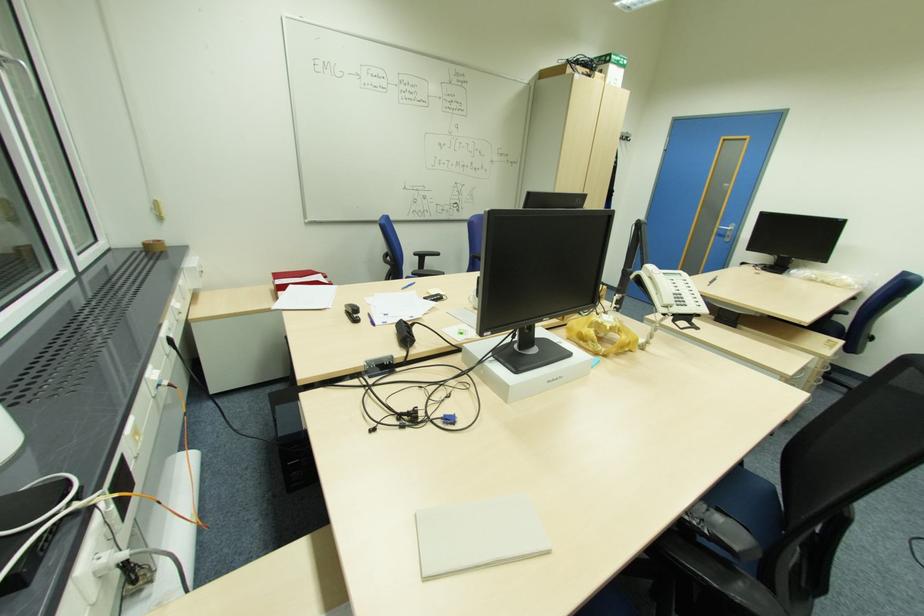
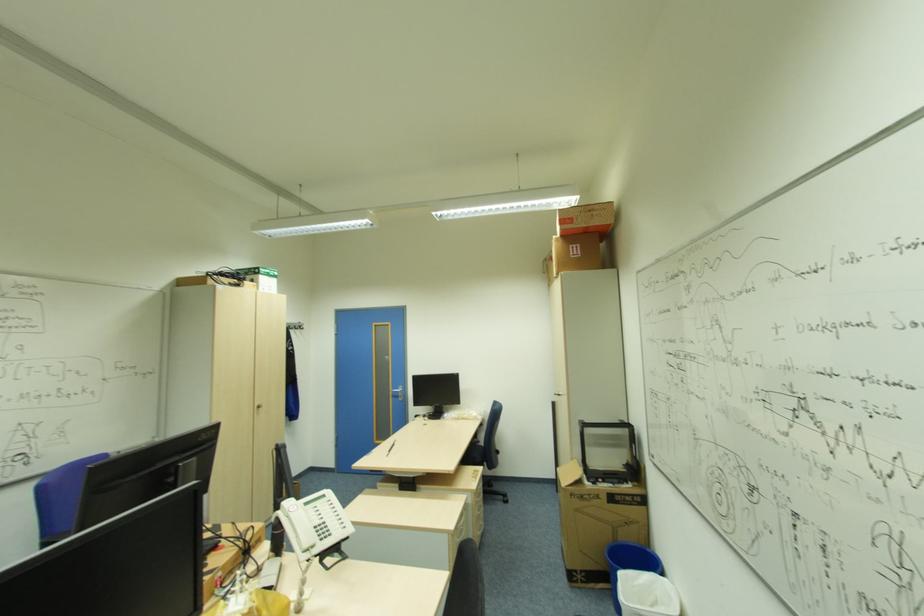
How did the camera likely rotate?

The camera rotated toward right-up.